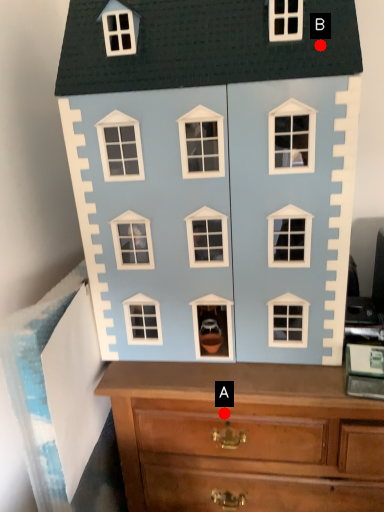
Question: Two points are circled on the image, labeled by A and B beside each circle. Which point is farther from the camera taking this photo?

Choices:
 (A) A is further
 (B) B is further

Answer: (A)